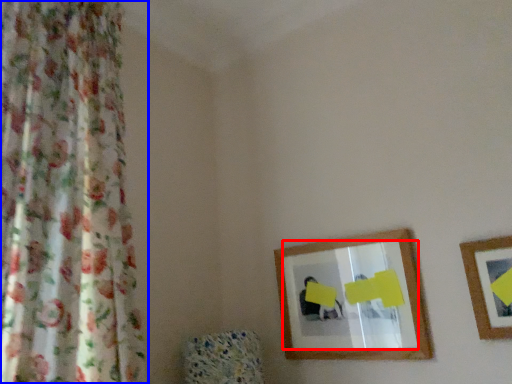
Question: Which object is closer to the camera taking this photo, mirror (highlighted by a red box) or curtain (highlighted by a blue box)?

Choices:
 (A) mirror
 (B) curtain

Answer: (B)